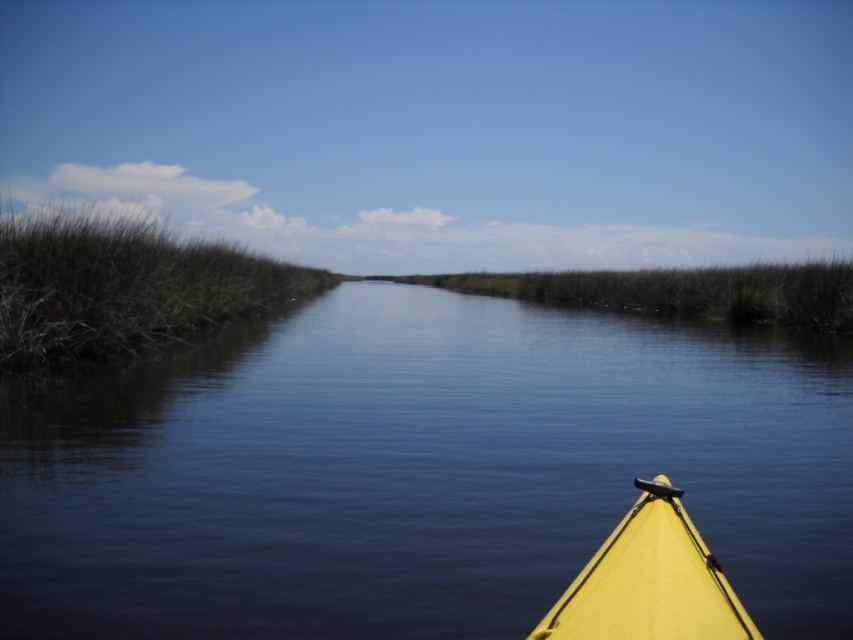
Question: Which object appears closest to the camera in this image?

Choices:
 (A) yellow matte kayak at lower right
 (B) smooth water at center

Answer: (A)

Question: From the image, what is the correct spatial relationship of smooth water at center in relation to brown grass at left?

Choices:
 (A) above
 (B) below

Answer: (B)

Question: Based on their relative distances, which object is nearer to the smooth water at center?

Choices:
 (A) yellow matte kayak at lower right
 (B) brown grass at left

Answer: (A)

Question: Which point is closer to the camera taking this photo?

Choices:
 (A) (169, 291)
 (B) (556, 602)

Answer: (B)

Question: Does smooth water at center appear on the right side of brown grass at left?

Choices:
 (A) no
 (B) yes

Answer: (B)

Question: Can you confirm if smooth water at center is thinner than brown grass at left?

Choices:
 (A) yes
 (B) no

Answer: (B)